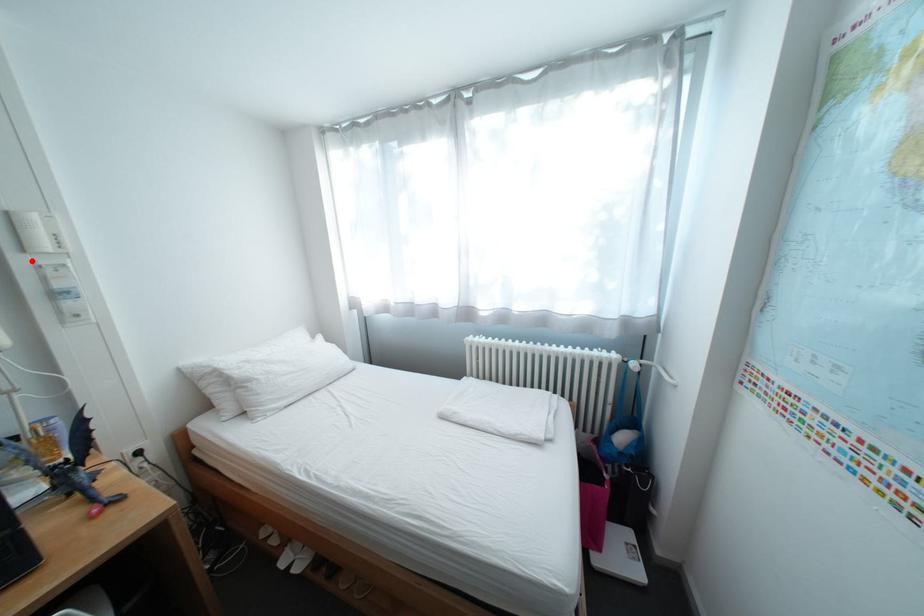
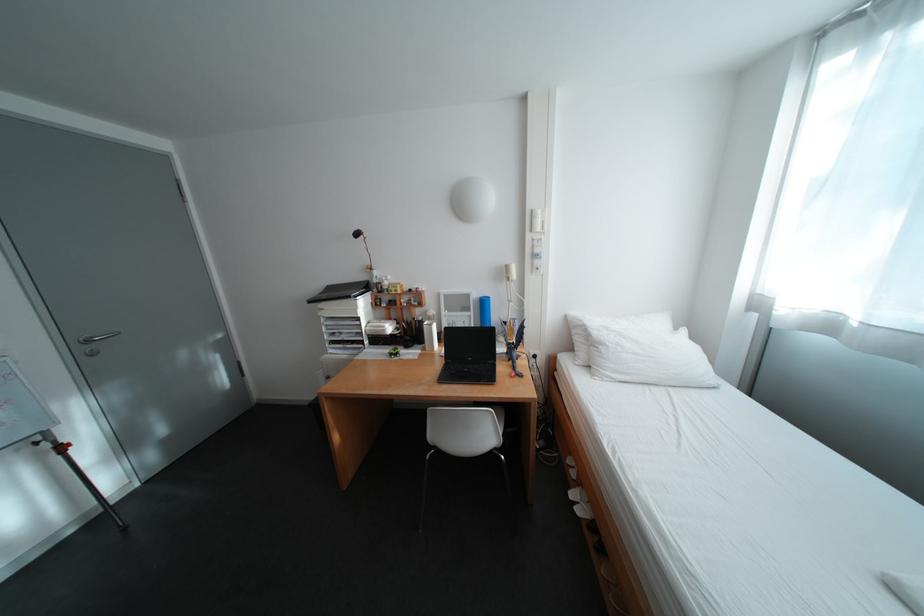
In the second image, find the point that corresponds to the highlighted location in the first image.

(541, 237)